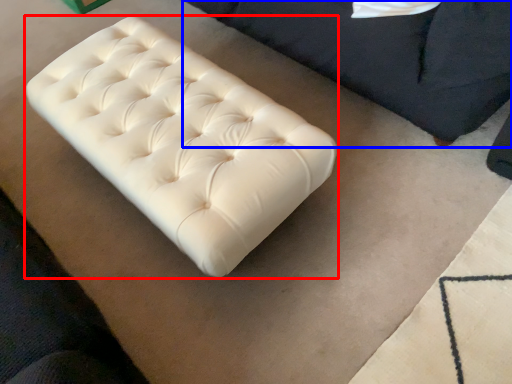
Question: Among these objects, which one is nearest to the camera, furniture (highlighted by a red box) or furniture (highlighted by a blue box)?

Choices:
 (A) furniture
 (B) furniture

Answer: (B)